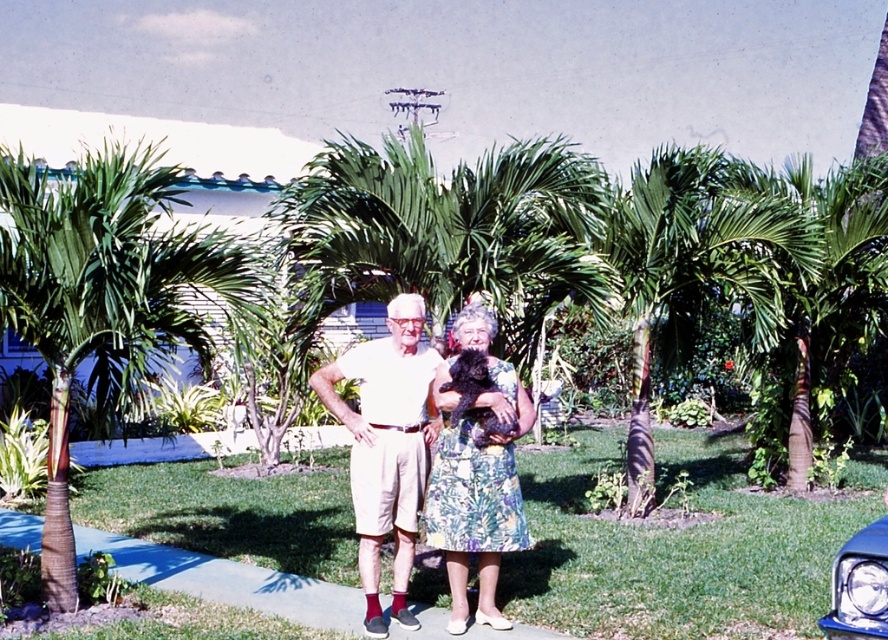
Consider the image. You are standing at the point marked by coordinates point (815, 301). Looking around, you see a green leafy palm tree at center right. Which direction should you walk to reach the green leafy palm tree at center right?

The point (815, 301) is already on the green leafy palm tree at center right, so you are already at the location of the green leafy palm tree at center right.

You are standing on the paved pathway and want to place a small potted plant between the two points labeled point (813,342) and point (414,296). Which point should the plant be closer to if it needs to be closer to the viewer?

The plant should be closer to point (813,342) because it is further to the viewer than point (414,296).